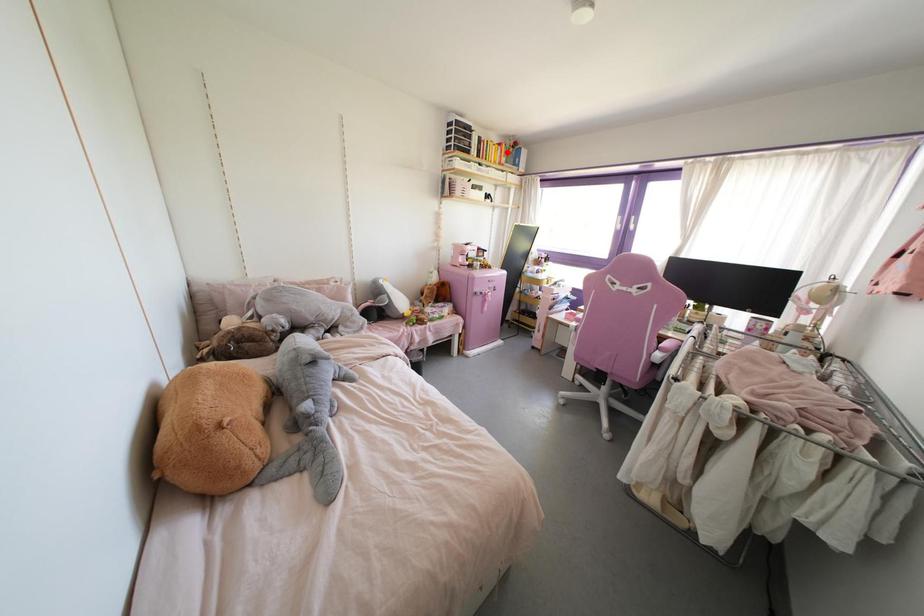
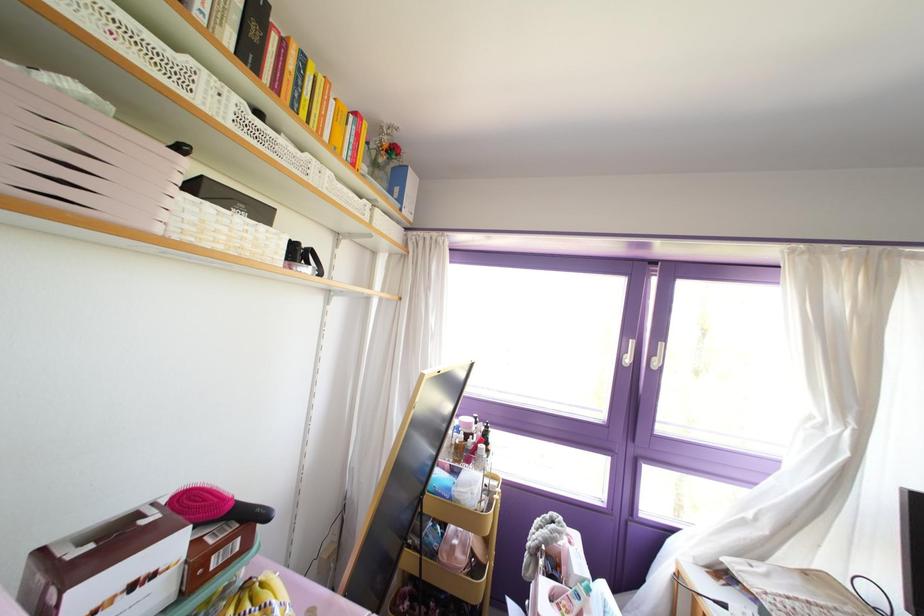
Question: I am providing you with two images of the same scene from different viewpoints. A red point is marked on the first image. At the location where the point appears in image 1, is it still visible in image 2?

Choices:
 (A) Yes
 (B) No

Answer: (A)